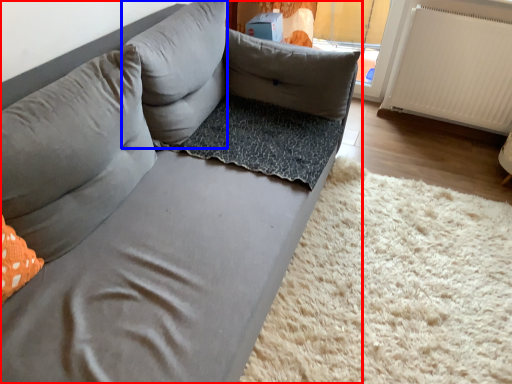
Question: Which object appears farthest to the camera in this image, studio couch (highlighted by a red box) or pillow (highlighted by a blue box)?

Choices:
 (A) studio couch
 (B) pillow

Answer: (B)